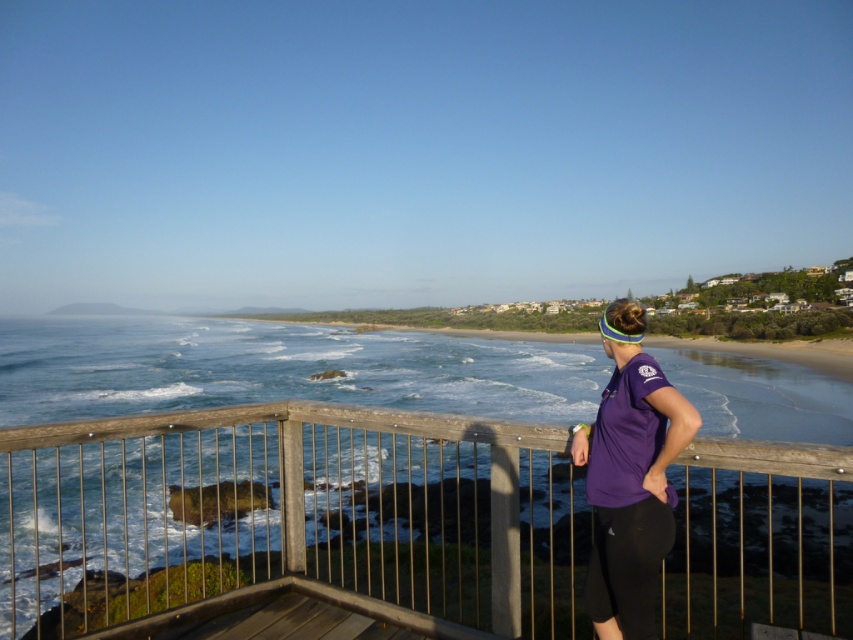
Does wooden railing at center have a greater height compared to purple fabric shirt at center?

Indeed, wooden railing at center has a greater height compared to purple fabric shirt at center.

What do you see at coordinates (291, 515) in the screenshot? I see `wooden railing at center` at bounding box center [291, 515].

Locate an element on the screen. The image size is (853, 640). wooden railing at center is located at coordinates (291, 515).

The height and width of the screenshot is (640, 853). Find the location of `wooden railing at center`. wooden railing at center is located at coordinates (291, 515).